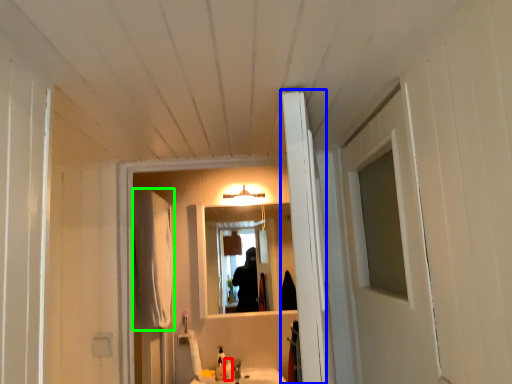
Question: Which object is the farthest from toiletry (highlighted by a red box)? Choose among these: door (highlighted by a blue box) or curtain (highlighted by a green box).

Choices:
 (A) door
 (B) curtain

Answer: (A)